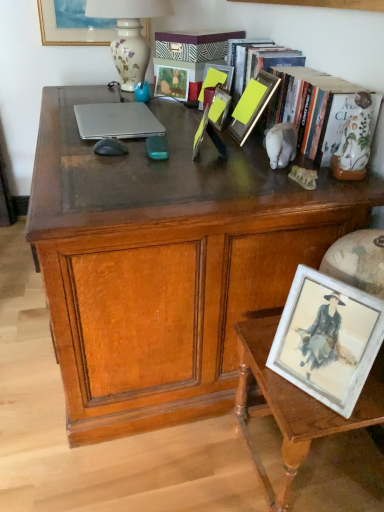
Find the location of `free space in front of white glossy picture frame at lower right, the seventh picture frame positioned from the back`. free space in front of white glossy picture frame at lower right, the seventh picture frame positioned from the back is located at coordinates (310, 414).